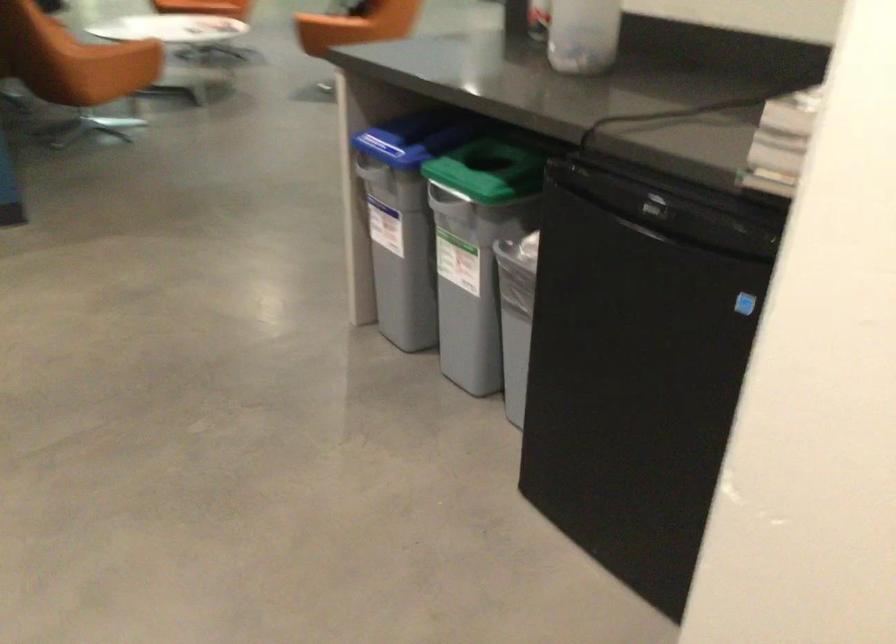
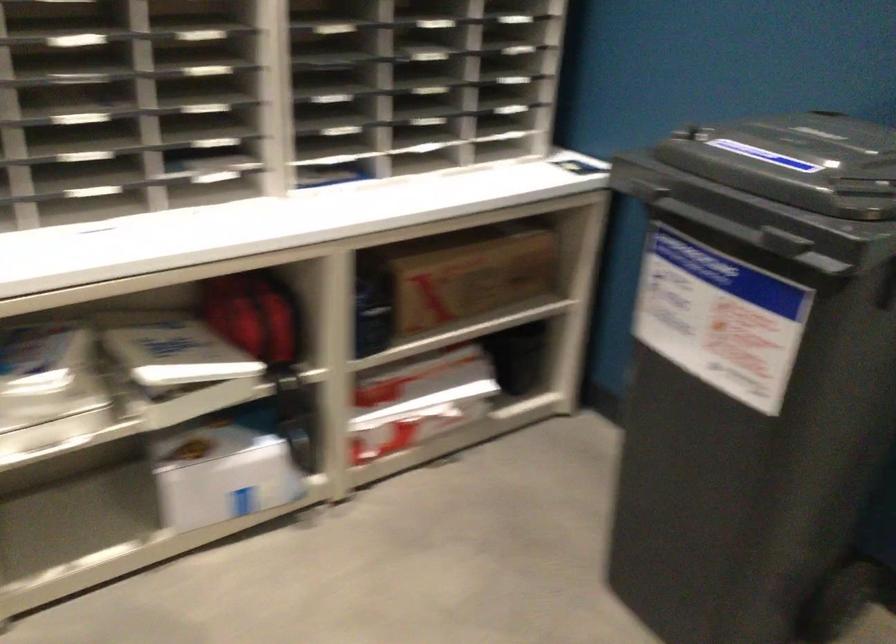
The images are taken continuously from a first-person perspective. In which direction are you moving?

The cameraman walked toward left, forward.